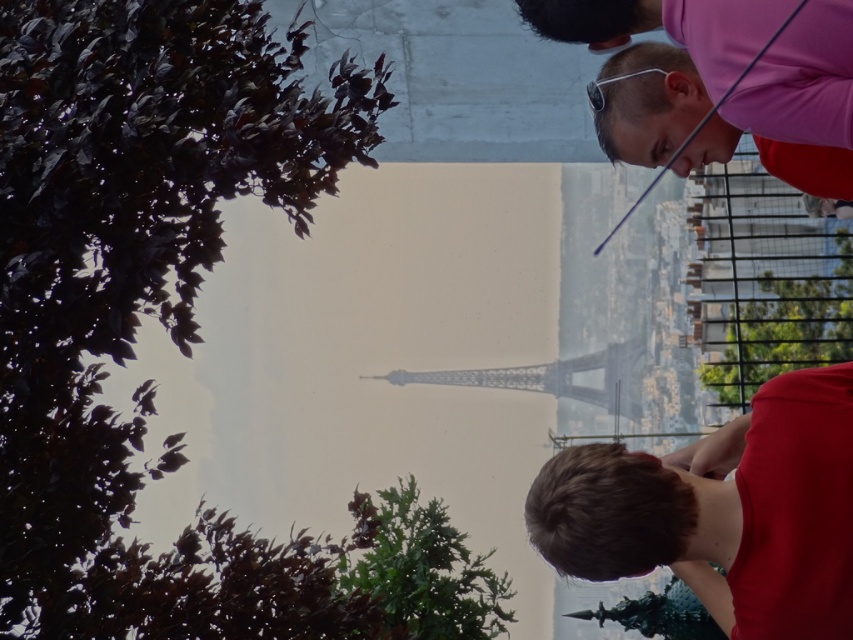
Who is more distant from viewer, (752, 460) or (642, 60)?

Point (642, 60)

Where is `brown hair at lower right`? brown hair at lower right is located at coordinates (722, 512).

Who is positioned more to the left, pink fabric at upper right or metallic gray eiffel tower at center?

metallic gray eiffel tower at center is more to the left.

Is pink fabric at upper right to the left of metallic gray eiffel tower at center from the viewer's perspective?

No, pink fabric at upper right is not to the left of metallic gray eiffel tower at center.

Does point (703, 144) lie behind point (502, 376)?

No, it is in front of (502, 376).

This screenshot has height=640, width=853. I want to click on pink fabric at upper right, so click(x=647, y=104).

Is brown hair at lower right closer to the viewer compared to metallic gray eiffel tower at center?

Yes, brown hair at lower right is closer to the viewer.

Can you confirm if brown hair at lower right is positioned above metallic gray eiffel tower at center?

Incorrect, brown hair at lower right is not positioned above metallic gray eiffel tower at center.

Is point (776, 612) positioned in front of point (579, 368)?

Yes, it is in front of point (579, 368).

At what (x,y) coordinates should I click in order to perform the action: click on brown hair at lower right. Please return your answer as a coordinate pair (x, y). The image size is (853, 640). Looking at the image, I should click on (722, 512).